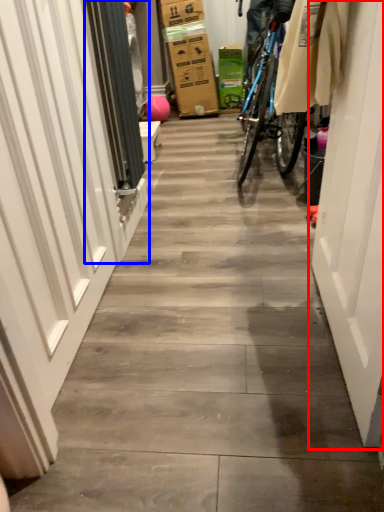
Question: Which point is closer to the camera, door (highlighted by a red box) or screen door (highlighted by a blue box)?

Choices:
 (A) door
 (B) screen door

Answer: (A)